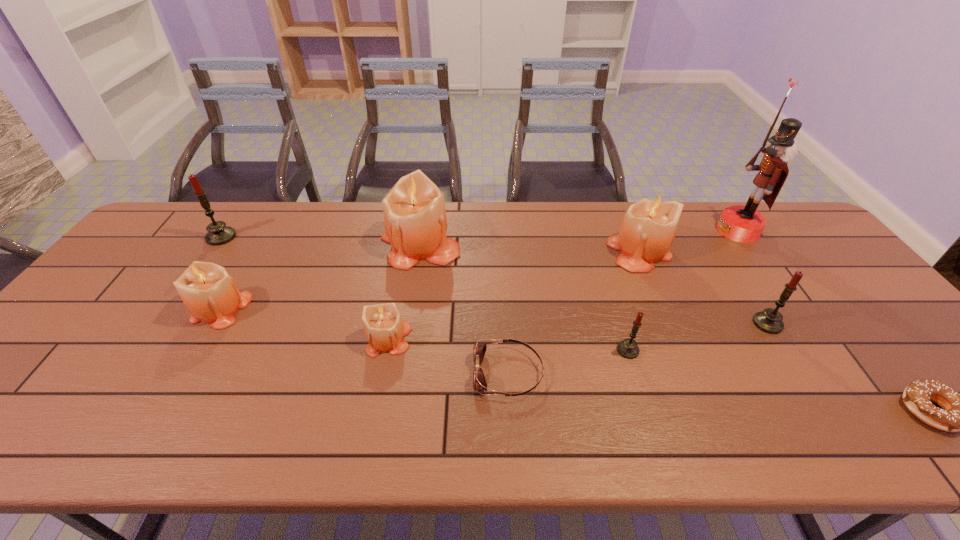
Where is `free space between the farthest red candle and the second red candle from left to right`? This screenshot has width=960, height=540. free space between the farthest red candle and the second red candle from left to right is located at coordinates (424, 294).

The image size is (960, 540). In order to click on object that stands as the sixth closest to the chocolate doughnut in this screenshot , I will do [414, 211].

Identify the location of the fifth closest object to the red nutcracker. (479, 382).

Where is `candle that can be found as the seventh closest to the nutcracker`? candle that can be found as the seventh closest to the nutcracker is located at coordinates (218, 233).

Select which candle appears as the third closest to the nutcracker. Please provide its 2D coordinates. Your answer should be formatted as a tuple, i.e. [(x, y)], where the tuple contains the x and y coordinates of a point satisfying the conditions above.

[(628, 348)]

Select which beige candle appears as the third closest to the second smallest beige candle. Please provide its 2D coordinates. Your answer should be formatted as a tuple, i.e. [(x, y)], where the tuple contains the x and y coordinates of a point satisfying the conditions above.

[(648, 228)]

I want to click on beige candle object that ranks as the closest to the rightmost candle, so click(648, 228).

This screenshot has height=540, width=960. I want to click on the second closest red candle relative to the leftmost red candle, so click(769, 320).

Where is `the second closest red candle to the red nutcracker`? the second closest red candle to the red nutcracker is located at coordinates (628, 348).

Identify the location of vacant space that satisfies the following two spatial constraints: 1. on the front side of the fifth object from right to left; 2. through the lenses of the sixth object from right to left. The height and width of the screenshot is (540, 960). (635, 373).